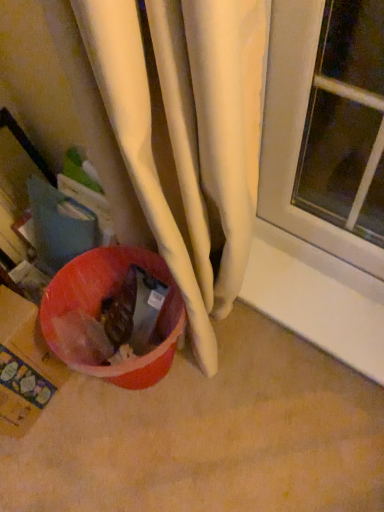
Locate an element on the screen. The width and height of the screenshot is (384, 512). free space to the right of cardboard box at lower left is located at coordinates (86, 415).